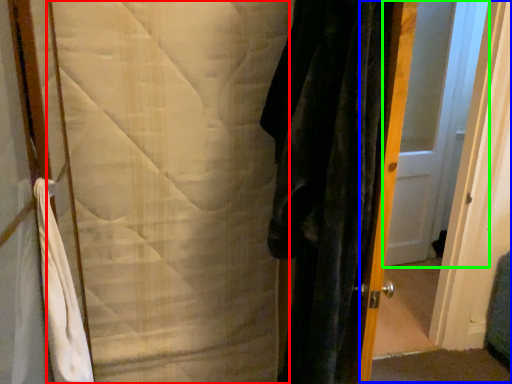
Question: Which is farther away from blanket (highlighted by a red box)? screen door (highlighted by a blue box) or door (highlighted by a green box)?

Choices:
 (A) screen door
 (B) door

Answer: (B)